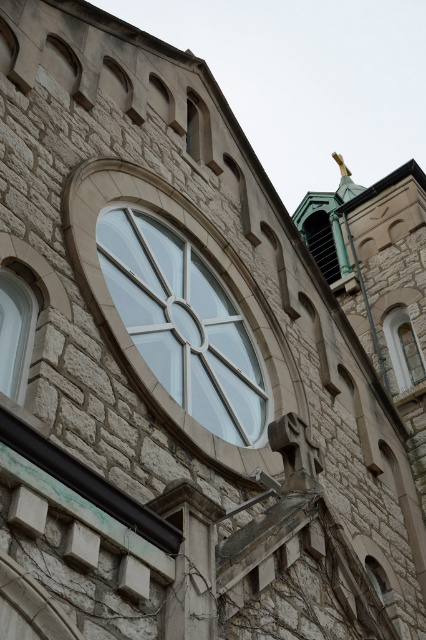
Question: Which point is closer to the camera taking this photo?

Choices:
 (A) (196, 109)
 (B) (2, 320)
 (C) (222, 332)
 (D) (314, 248)

Answer: (B)

Question: Which point is farther to the camera?

Choices:
 (A) clear glass window at left
 (B) clear glass window at upper right

Answer: (B)

Question: Which point is closer to the camera taking this photo?

Choices:
 (A) (5, 365)
 (B) (120, 282)
 (C) (187, 148)
 (D) (422, 362)

Answer: (A)

Question: Does clear glass window at left lie in front of clear glass window at upper center?

Choices:
 (A) no
 (B) yes

Answer: (B)

Question: Where is green glass window at upper center located in relation to clear glass window at upper center in the image?

Choices:
 (A) left
 (B) right

Answer: (B)

Question: Can you confirm if clear glass window at upper right is smaller than clear glass window at upper center?

Choices:
 (A) yes
 (B) no

Answer: (B)